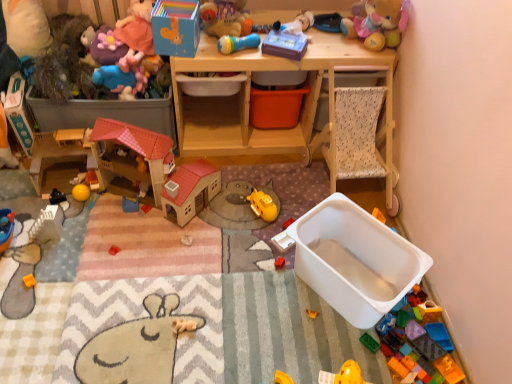
The height and width of the screenshot is (384, 512). I want to click on vacant area that lies between white plastic toy at center, arranged as the tenth toy when viewed from the left, and blue plastic toy at center, the 5th toy viewed from the left, so click(x=221, y=231).